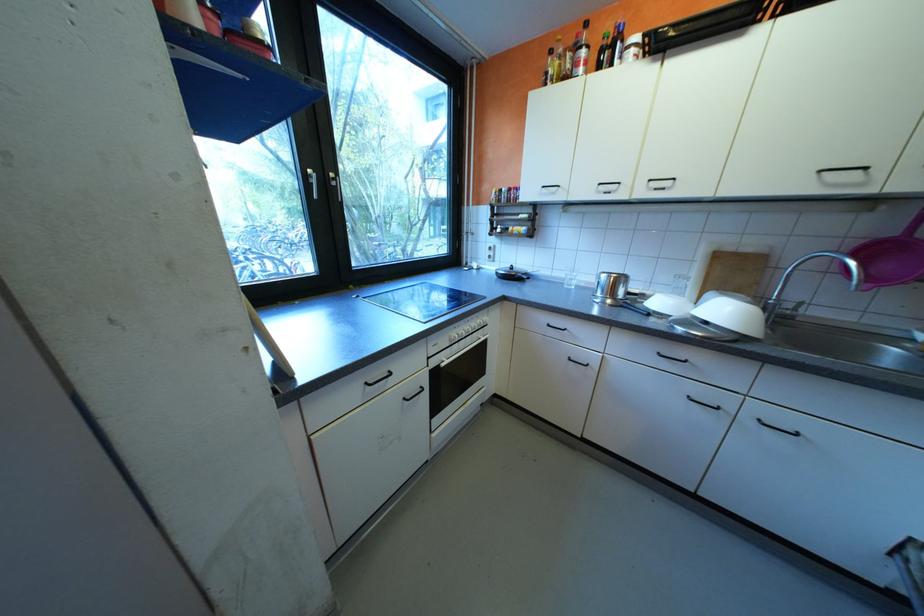
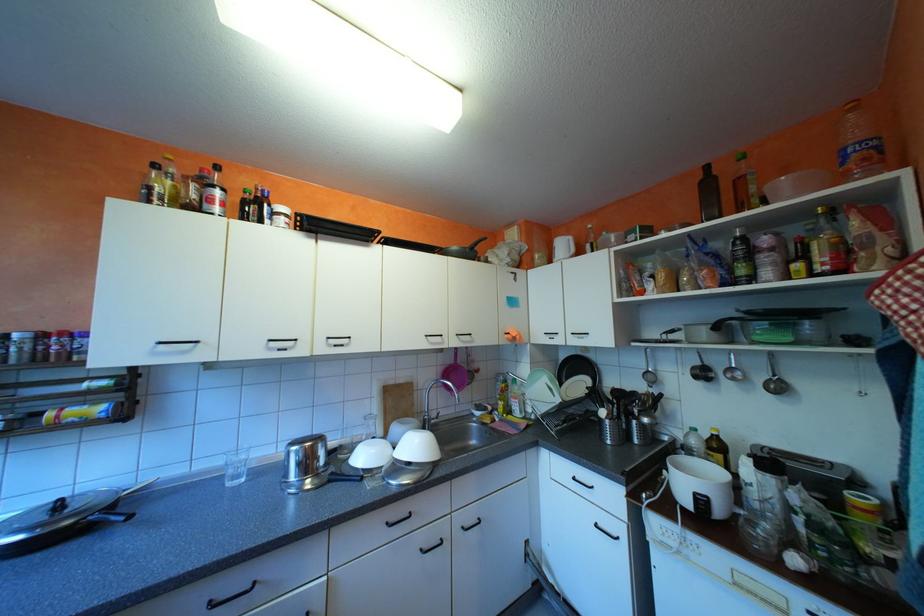
Question: How did the camera likely rotate?

Choices:
 (A) Left
 (B) Right
 (C) Up
 (D) Down

Answer: (B)